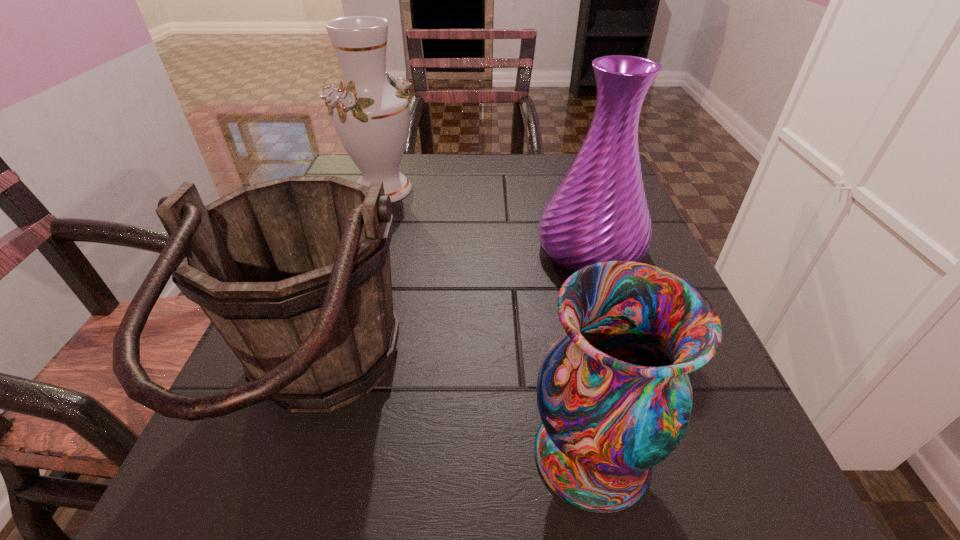
Where is `bucket that is at the near edge`? Image resolution: width=960 pixels, height=540 pixels. bucket that is at the near edge is located at coordinates (294, 273).

This screenshot has height=540, width=960. I want to click on vase present at the near edge, so click(x=613, y=394).

The width and height of the screenshot is (960, 540). I want to click on vase that is positioned at the left edge, so click(371, 116).

Locate an element on the screen. The width and height of the screenshot is (960, 540). bucket that is at the left edge is located at coordinates (294, 273).

The height and width of the screenshot is (540, 960). Find the location of `object that is at the far left corner`. object that is at the far left corner is located at coordinates (371, 116).

Locate an element on the screen. object that is at the near left corner is located at coordinates (294, 273).

Locate an element on the screen. This screenshot has width=960, height=540. object that is at the near right corner is located at coordinates (613, 394).

Where is `free space at the far edge of the desktop`? The width and height of the screenshot is (960, 540). free space at the far edge of the desktop is located at coordinates (492, 158).

The width and height of the screenshot is (960, 540). I want to click on vacant position at the left edge of the desktop, so click(323, 416).

I want to click on blank area at the right edge, so click(732, 464).